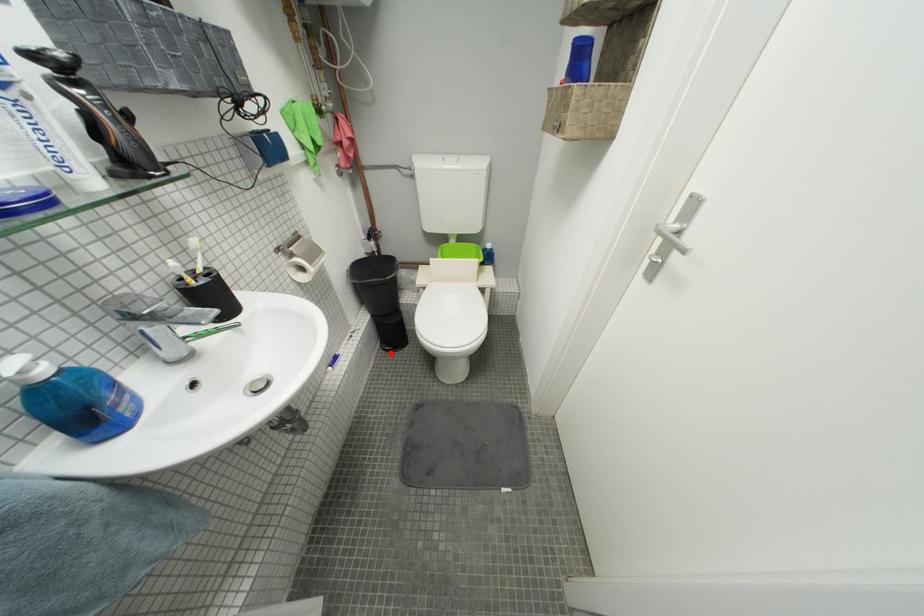
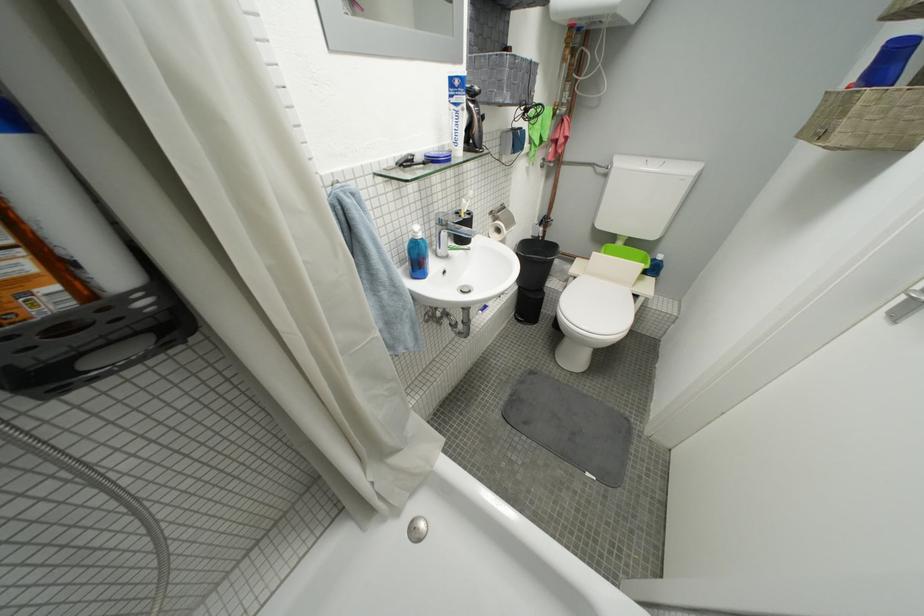
Question: A red point is marked in image1. In image2, is the corresponding 3D point closer to the camera or farther? Reply with the corresponding letter.

Choices:
 (A) The corresponding 3D point is closer.
 (B) The corresponding 3D point is farther.

Answer: (A)